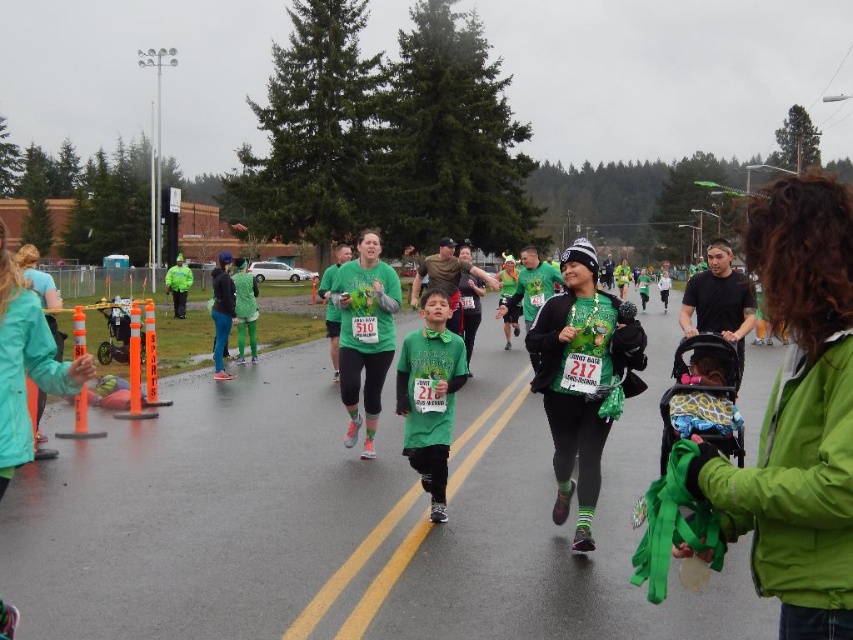
You are a photographer standing at the starting line of the race. You want to take a photo that includes both the point at coordinates point (805,224) and point (549,333). Which point should you focus on first to ensure both are in focus?

You should focus on point (805,224) first because it is closer to the camera than point (549,333). By focusing on the closer point, the farther point will also be within the depth of field.

You are a photographer at the event and want to capture a photo of both the green matte jacket at center and the matte green jacket at center. Which one is positioned higher in the image?

The green matte jacket at center is positioned higher than the matte green jacket at center in the image.

You are a photographer standing at the center of the scene. You want to take a photo of the green matte jacket at center. Which direction should you move to get a better shot?

The green matte jacket at center is already at the center of the scene, so you don not need to move. You can take the photo from your current position.